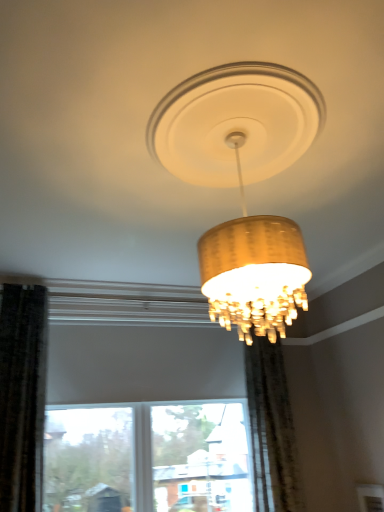
This screenshot has width=384, height=512. Describe the element at coordinates (242, 184) in the screenshot. I see `matte gold chandelier at center` at that location.

In order to face matte gold chandelier at center, should I rotate leftwards or rightwards?

Turn right by 7.398 degrees to look at matte gold chandelier at center.

This screenshot has width=384, height=512. I want to click on matte gold chandelier at center, so click(242, 184).

Locate an element on the screen. sheer beige curtain at center is located at coordinates (271, 429).

Image resolution: width=384 pixels, height=512 pixels. What do you see at coordinates (271, 429) in the screenshot? I see `sheer beige curtain at center` at bounding box center [271, 429].

What is the approximate width of sheer beige curtain at center?

sheer beige curtain at center is 11.81 inches wide.

Locate an element on the screen. matte gold chandelier at center is located at coordinates (242, 184).

Can you confirm if matte gold chandelier at center is positioned to the right of sheer beige curtain at center?

No.

Is the position of matte gold chandelier at center less distant than that of sheer beige curtain at center?

Yes, matte gold chandelier at center is in front of sheer beige curtain at center.

Which point is more distant from viewer, (245, 65) or (295, 454)?

The point (295, 454) is more distant.

From the image's perspective, who appears lower, matte gold chandelier at center or sheer beige curtain at center?

From the image's view, sheer beige curtain at center is below.

From a real-world perspective, which is physically above, matte gold chandelier at center or sheer beige curtain at center?

In real-world perspective, matte gold chandelier at center is above.

Does matte gold chandelier at center have a lesser width compared to sheer beige curtain at center?

No, matte gold chandelier at center is not thinner than sheer beige curtain at center.

Considering the sizes of objects matte gold chandelier at center and sheer beige curtain at center in the image provided, who is shorter, matte gold chandelier at center or sheer beige curtain at center?

With less height is matte gold chandelier at center.

Does matte gold chandelier at center have a larger size compared to sheer beige curtain at center?

Correct, matte gold chandelier at center is larger in size than sheer beige curtain at center.

Is sheer beige curtain at center a part of matte gold chandelier at center?

That's incorrect, sheer beige curtain at center is not inside matte gold chandelier at center.

Is matte gold chandelier at center not close to sheer beige curtain at center?

Indeed, matte gold chandelier at center is not near sheer beige curtain at center.

Is matte gold chandelier at center facing towards sheer beige curtain at center?

No, matte gold chandelier at center does not turn towards sheer beige curtain at center.

Can you tell me how much matte gold chandelier at center and sheer beige curtain at center differ in facing direction?

90 degrees.

At what (x,y) coordinates should I click in order to perform the action: click on curtain behind the matte gold chandelier at center. Please return your answer as a coordinate pair (x, y). Looking at the image, I should click on click(x=271, y=429).

Consider the image. Considering the relative positions of sheer beige curtain at center and matte gold chandelier at center in the image provided, is sheer beige curtain at center to the right of matte gold chandelier at center from the viewer's perspective?

Indeed, sheer beige curtain at center is positioned on the right side of matte gold chandelier at center.

Considering the positions of objects sheer beige curtain at center and matte gold chandelier at center in the image provided, who is behind, sheer beige curtain at center or matte gold chandelier at center?

sheer beige curtain at center.

Which point is more distant from viewer, (277,358) or (191,77)?

The point (277,358) is farther from the camera.

From the image's perspective, is sheer beige curtain at center on top of matte gold chandelier at center?

No, from the image's perspective, sheer beige curtain at center is not over matte gold chandelier at center.

From a real-world perspective, which is physically below, sheer beige curtain at center or matte gold chandelier at center?

sheer beige curtain at center.

In terms of width, does sheer beige curtain at center look wider or thinner when compared to matte gold chandelier at center?

Clearly, sheer beige curtain at center has less width compared to matte gold chandelier at center.

Who is taller, sheer beige curtain at center or matte gold chandelier at center?

sheer beige curtain at center is taller.

In terms of size, does sheer beige curtain at center appear bigger or smaller than matte gold chandelier at center?

sheer beige curtain at center is smaller than matte gold chandelier at center.

Is matte gold chandelier at center surrounded by sheer beige curtain at center?

No.

Is sheer beige curtain at center not close to matte gold chandelier at center?

That's right, there is a large distance between sheer beige curtain at center and matte gold chandelier at center.

Is sheer beige curtain at center oriented towards matte gold chandelier at center?

No, sheer beige curtain at center does not turn towards matte gold chandelier at center.

You are a GUI agent. You are given a task and a screenshot of the screen. Output one action in this format:
    pyautogui.click(x=<x>, y=<y>)
    Task: Click on the curtain on the right of matte gold chandelier at center
    
    Given the screenshot: What is the action you would take?
    pyautogui.click(x=271, y=429)

There is a sheer beige curtain at center. What are the coordinates of `lamp above it (from a real-world perspective)` in the screenshot? It's located at (242, 184).

Identify the location of curtain below the matte gold chandelier at center (from a real-world perspective). The image size is (384, 512). (271, 429).